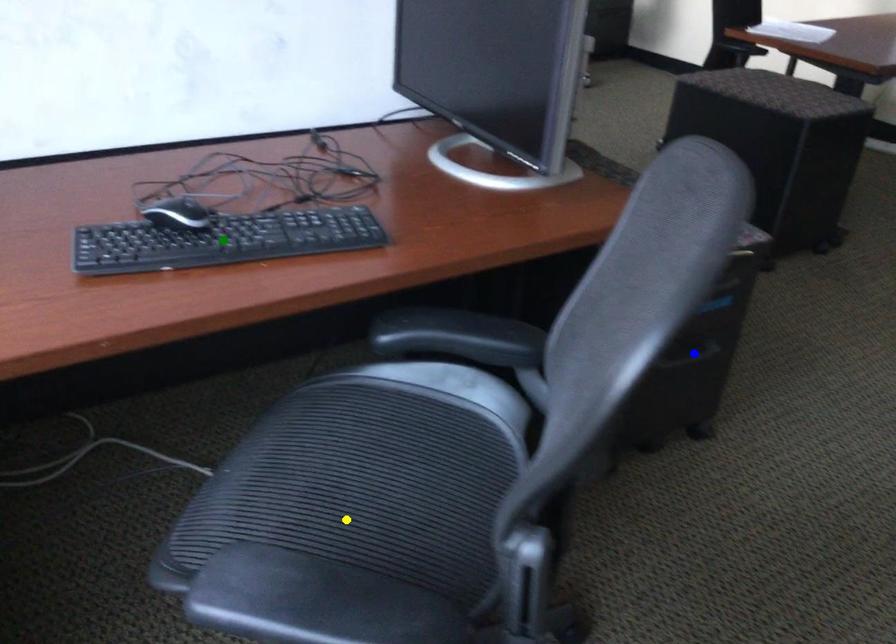
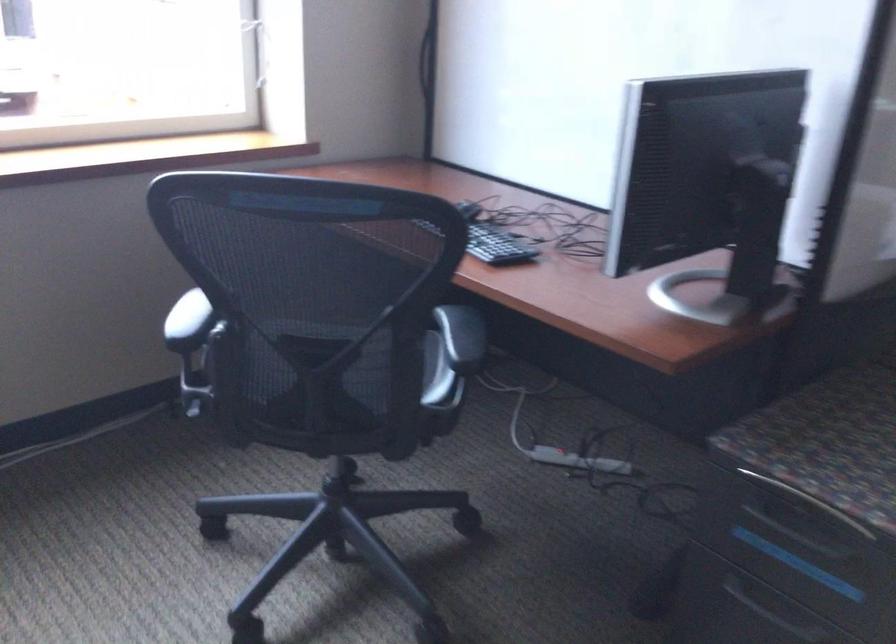
I am providing you with two images of the same scene from different viewpoints. Three points are marked in image1. Which point corresponds to a part or object that is occluded in image2?In image1, three points are marked. Which of them correspond to a part or object that is occluded in image2?Among the three points shown in image1, which one corresponds to a part or object that is no longer visible due to occlusion in image2?

yellow point, green point cannot be seen in image2.